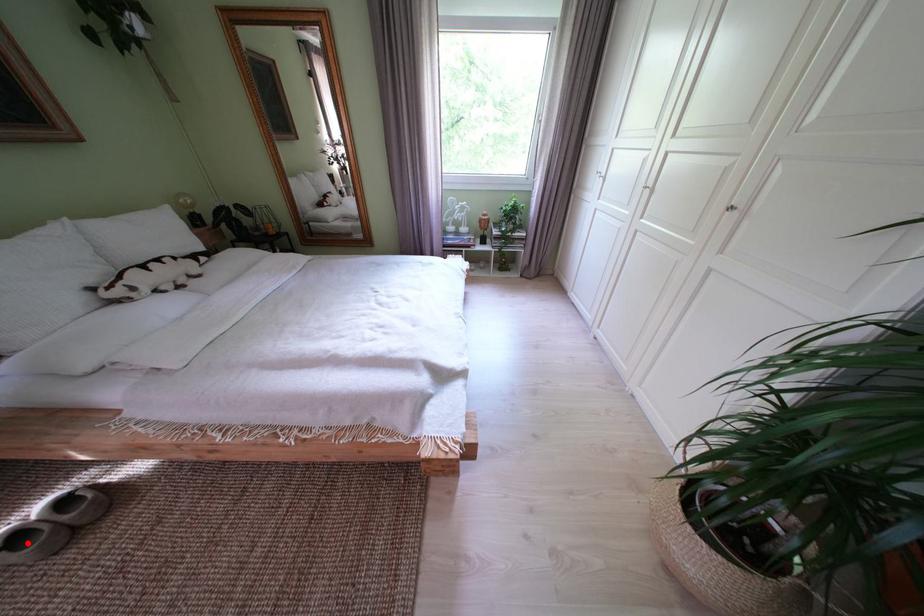
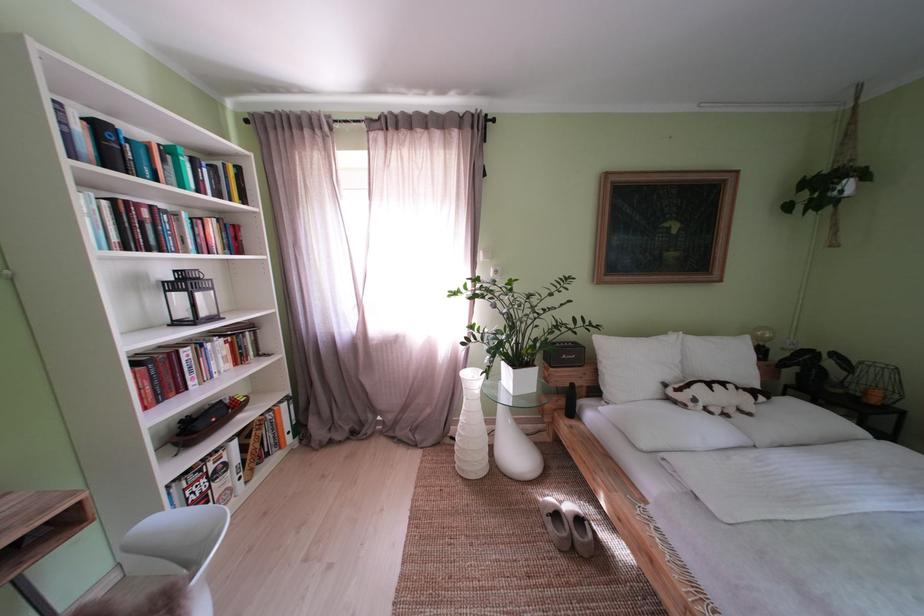
Find the pixel in the second image that matches the highlighted location in the first image.

(567, 521)